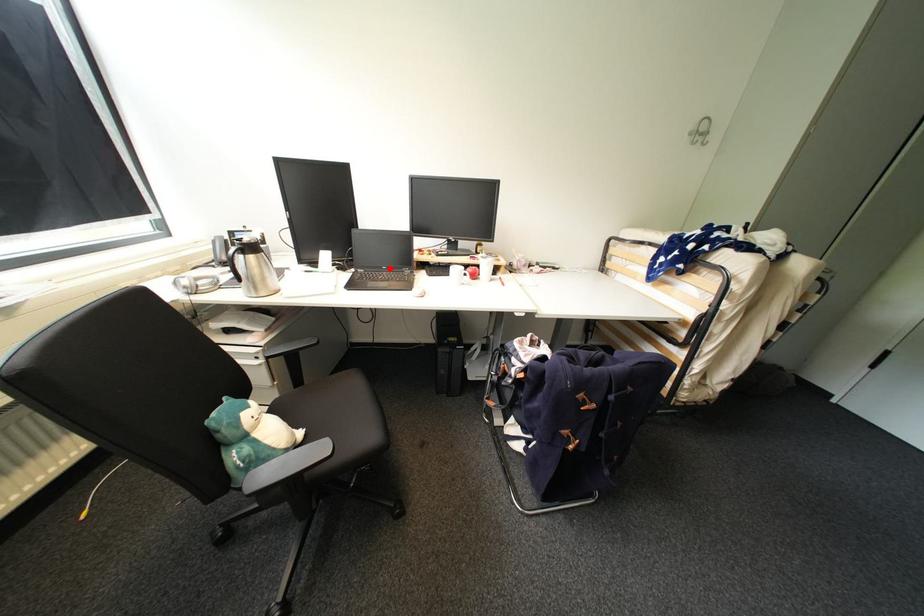
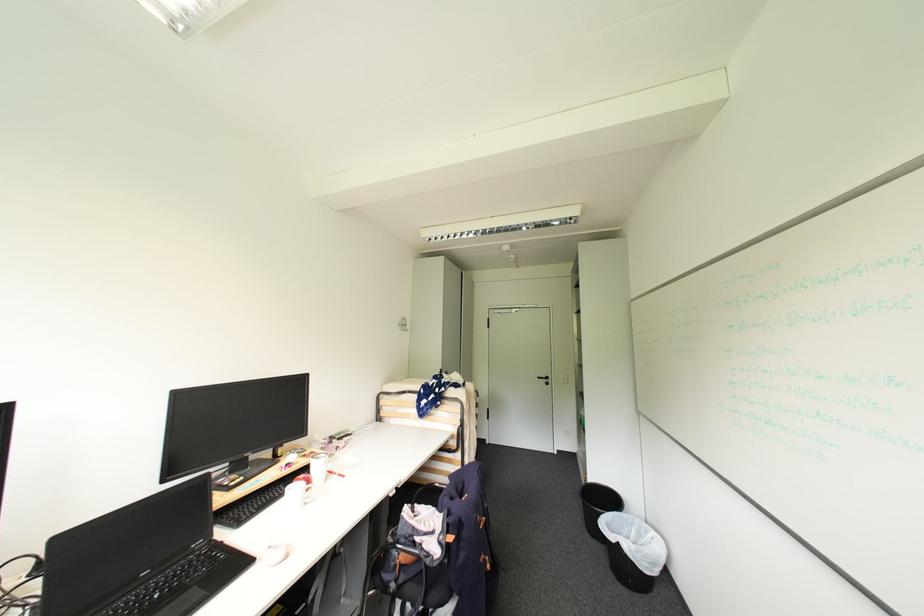
Locate, in the second image, the point that corresponds to the highlighted location in the first image.

(150, 575)